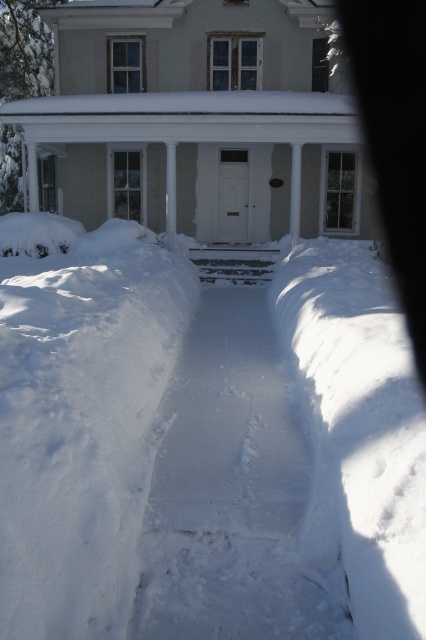
Question: Which object appears closest to the camera in this image?

Choices:
 (A) white snow at center
 (B) white smooth porch at center

Answer: (A)

Question: Among these points, which one is nearest to the camera?

Choices:
 (A) (199, 436)
 (B) (339, 115)

Answer: (A)

Question: Is white snow at center in front of white smooth porch at center?

Choices:
 (A) yes
 (B) no

Answer: (A)

Question: Does white snow at center appear over white smooth porch at center?

Choices:
 (A) yes
 (B) no

Answer: (B)

Question: Is white snow at center to the right of white smooth porch at center from the viewer's perspective?

Choices:
 (A) no
 (B) yes

Answer: (B)

Question: Which point appears farthest from the camera in this image?

Choices:
 (A) (311, 612)
 (B) (365, 205)

Answer: (B)